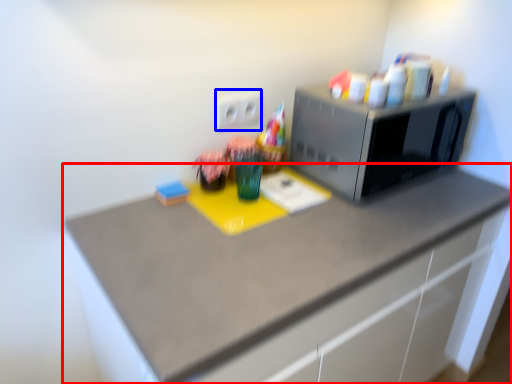
Question: Which point is further to the camera, countertop (highlighted by a red box) or electric outlet (highlighted by a blue box)?

Choices:
 (A) countertop
 (B) electric outlet

Answer: (B)